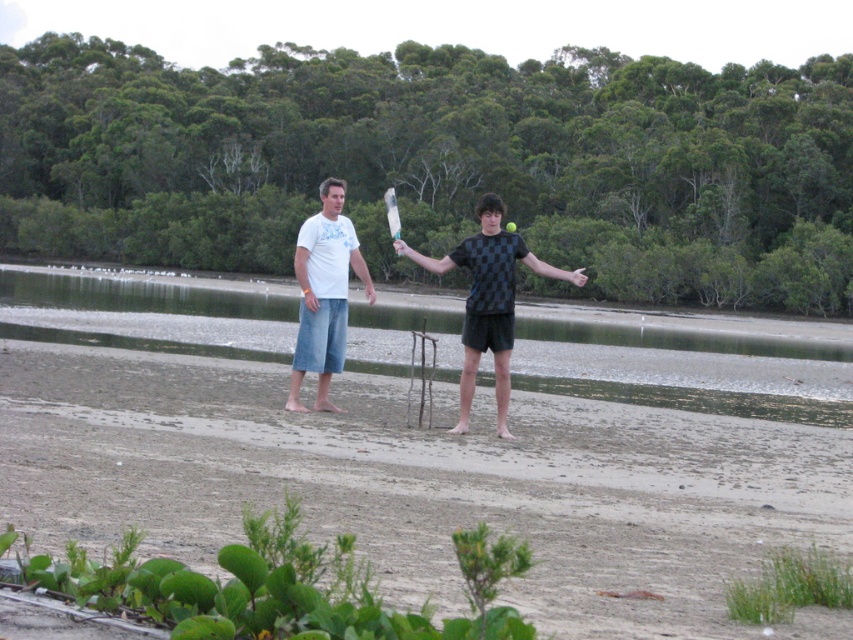
You are a photographer trying to capture the exact location of the ball in the image. The ball is at point (488, 300). Which object in the scene is this point located on?

The point (488, 300) is located on the matte white t shirt at center.